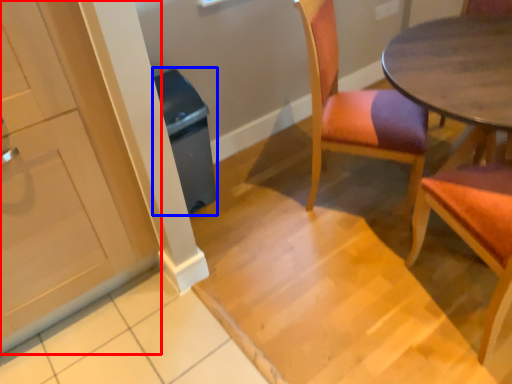
Question: Which object is further to the camera taking this photo, cabinetry (highlighted by a red box) or trash bin/can (highlighted by a blue box)?

Choices:
 (A) cabinetry
 (B) trash bin/can

Answer: (B)